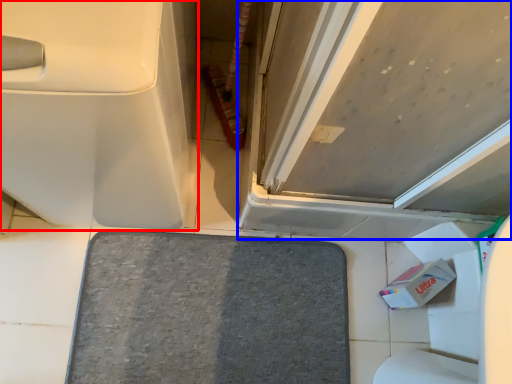
Question: Among these objects, which one is farthest to the camera, toilet (highlighted by a red box) or door (highlighted by a blue box)?

Choices:
 (A) toilet
 (B) door

Answer: (A)